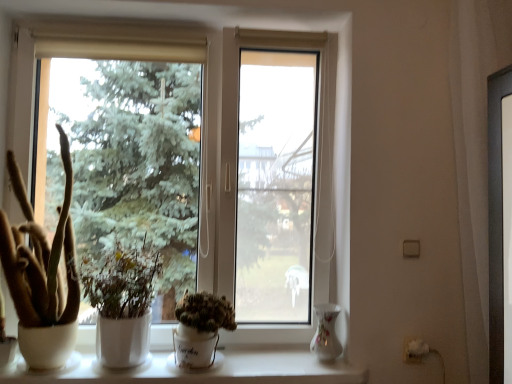
Find the location of a particular element. vacant region under transparent glass window at center (from a real-world perspective) is located at coordinates (233, 355).